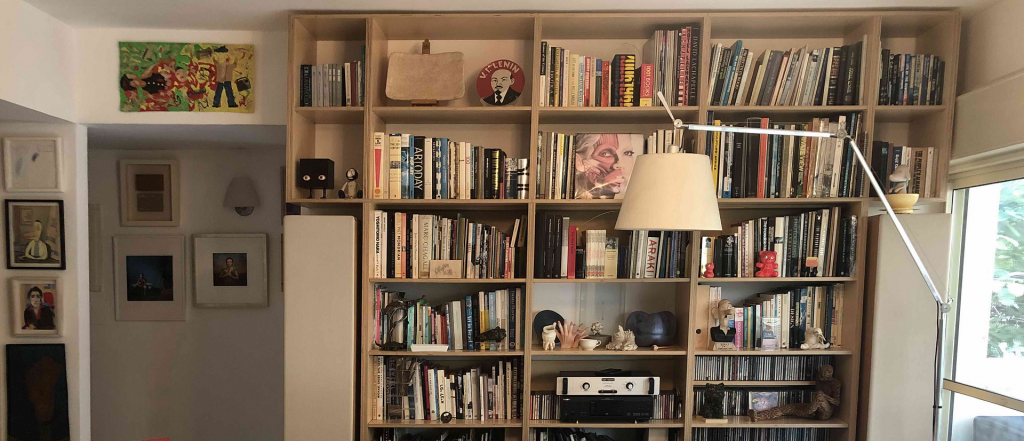
The height and width of the screenshot is (441, 1024). In order to click on light in hallway in this screenshot , I will do `click(245, 197)`.